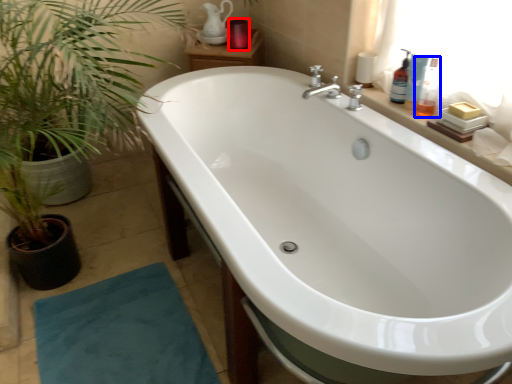
Question: Which point is closer to the camera, toiletry (highlighted by a red box) or toiletry (highlighted by a blue box)?

Choices:
 (A) toiletry
 (B) toiletry

Answer: (B)